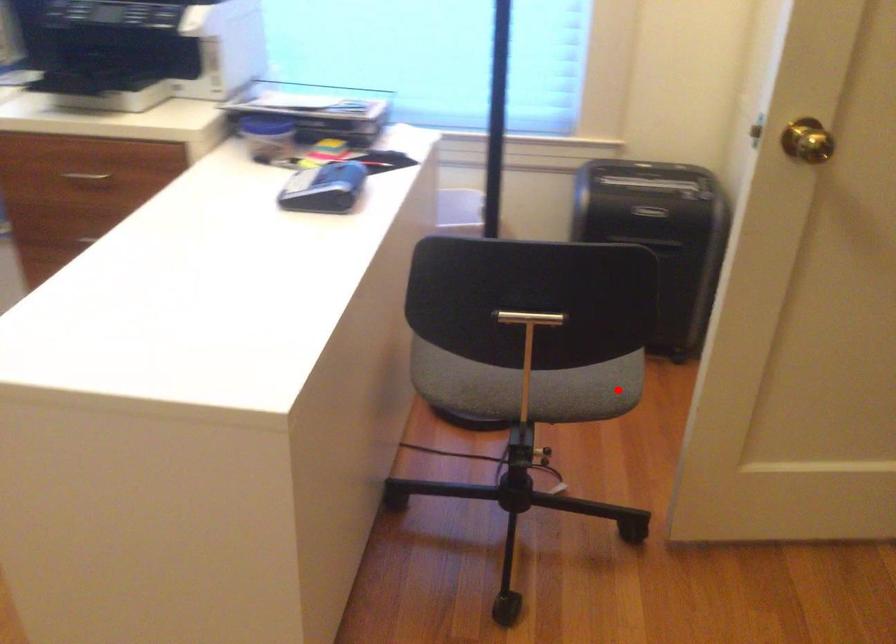
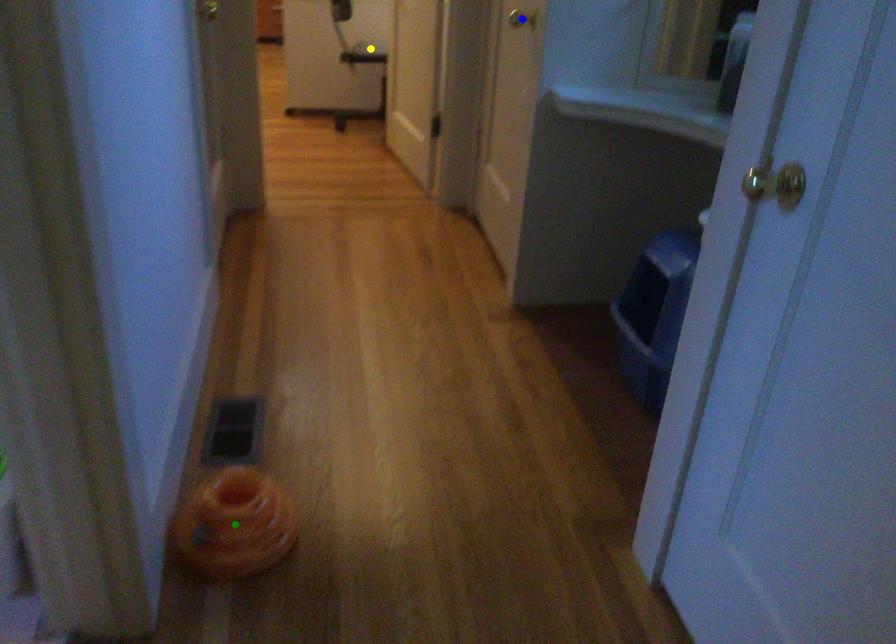
Question: I am providing you with two images of the same scene from different viewpoints. A red point is marked on the first image. You are given multiple points on the second image. Which point in image 2 represents the same 3d spot as the red point in image 1?

Choices:
 (A) yellow point
 (B) blue point
 (C) green point

Answer: (A)